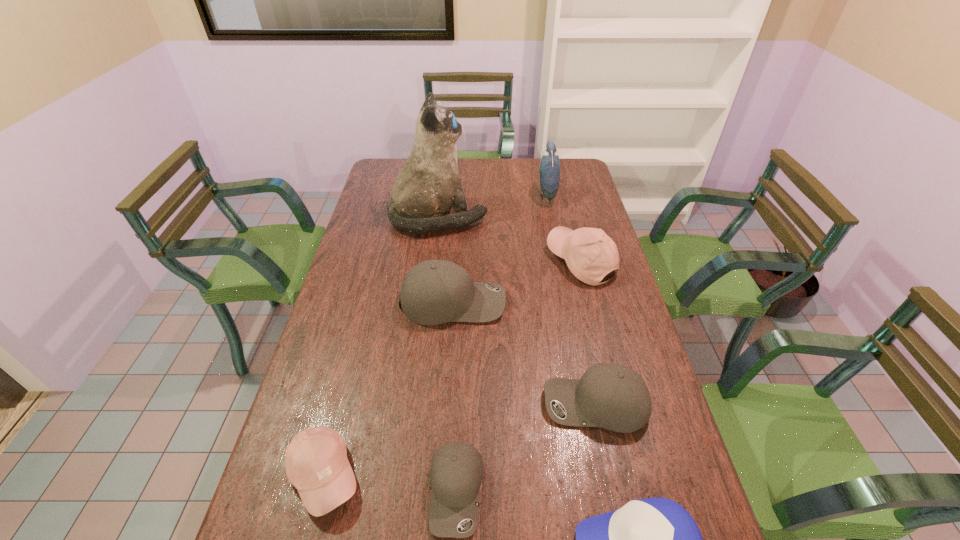
This screenshot has width=960, height=540. I want to click on vacant space that's between the tallest object and the farther pink baseball cap, so click(510, 240).

Identify which object is the seventh nearest to the rightmost gray baseball cap. Please provide its 2D coordinates. Your answer should be formatted as a tuple, i.e. [(x, y)], where the tuple contains the x and y coordinates of a point satisfying the conditions above.

[(549, 170)]

This screenshot has height=540, width=960. I want to click on the closest object to the cat, so click(x=590, y=254).

Locate which baseball cap ranks third in proximity to the left pink baseball cap. Please provide its 2D coordinates. Your answer should be formatted as a tuple, i.e. [(x, y)], where the tuple contains the x and y coordinates of a point satisfying the conditions above.

[(612, 396)]

Locate an element on the screen. baseball cap that is the fourth closest to the bigger pink baseball cap is located at coordinates (655, 539).

Select which gray baseball cap is the second closest to the second biggest gray baseball cap. Please provide its 2D coordinates. Your answer should be formatted as a tuple, i.e. [(x, y)], where the tuple contains the x and y coordinates of a point satisfying the conditions above.

[(433, 292)]

Choose which gray baseball cap is the second nearest neighbor to the rightmost gray baseball cap. Please provide its 2D coordinates. Your answer should be formatted as a tuple, i.e. [(x, y)], where the tuple contains the x and y coordinates of a point satisfying the conditions above.

[(433, 292)]